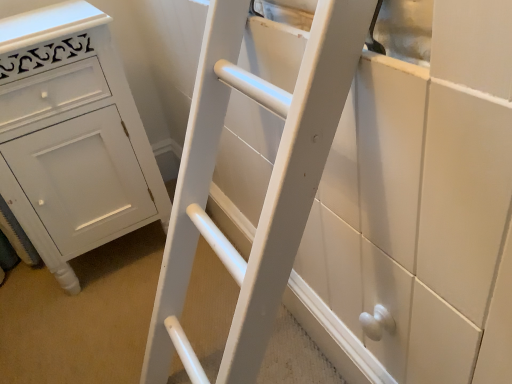
Question: Should I look upward or downward to see white painted wood chest of drawers at left?

Choices:
 (A) up
 (B) down

Answer: (A)

Question: Can you confirm if white painted wood chest of drawers at left is bigger than white matte ladder at center?

Choices:
 (A) no
 (B) yes

Answer: (B)

Question: Does white painted wood chest of drawers at left touch white matte ladder at center?

Choices:
 (A) no
 (B) yes

Answer: (A)

Question: From a real-world perspective, is white painted wood chest of drawers at left below white matte ladder at center?

Choices:
 (A) yes
 (B) no

Answer: (B)

Question: Can you confirm if white painted wood chest of drawers at left is thinner than white matte ladder at center?

Choices:
 (A) no
 (B) yes

Answer: (A)

Question: Considering the relative sizes of white painted wood chest of drawers at left and white matte ladder at center in the image provided, is white painted wood chest of drawers at left shorter than white matte ladder at center?

Choices:
 (A) no
 (B) yes

Answer: (A)

Question: Is white painted wood chest of drawers at left further to the viewer compared to white matte ladder at center?

Choices:
 (A) no
 (B) yes

Answer: (B)

Question: Is white matte ladder at center taller than white painted wood chest of drawers at left?

Choices:
 (A) no
 (B) yes

Answer: (A)

Question: Does white matte ladder at center have a smaller size compared to white painted wood chest of drawers at left?

Choices:
 (A) yes
 (B) no

Answer: (A)

Question: Is white matte ladder at center shorter than white painted wood chest of drawers at left?

Choices:
 (A) no
 (B) yes

Answer: (B)

Question: Is white matte ladder at center positioned with its back to white painted wood chest of drawers at left?

Choices:
 (A) yes
 (B) no

Answer: (B)

Question: From a real-world perspective, is white matte ladder at center physically above white painted wood chest of drawers at left?

Choices:
 (A) yes
 (B) no

Answer: (B)

Question: Considering the relative sizes of white matte ladder at center and white painted wood chest of drawers at left in the image provided, is white matte ladder at center thinner than white painted wood chest of drawers at left?

Choices:
 (A) yes
 (B) no

Answer: (A)

Question: Does point (112, 147) appear closer or farther from the camera than point (240, 291)?

Choices:
 (A) farther
 (B) closer

Answer: (A)